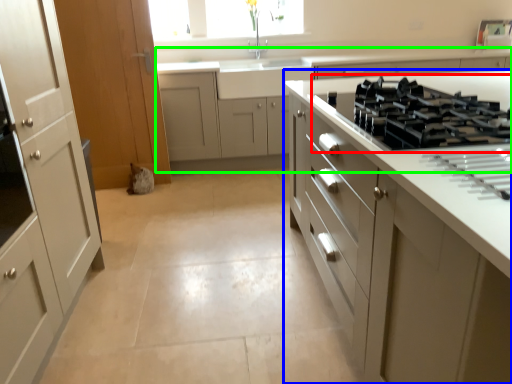
Question: Which is farther away from gas stove (highlighted by a red box)? cabinetry (highlighted by a blue box) or cabinetry (highlighted by a green box)?

Choices:
 (A) cabinetry
 (B) cabinetry

Answer: (B)